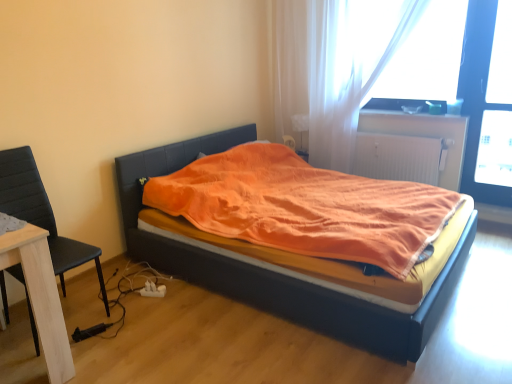
Question: Is transparent glass screen door at upper right facing towards translucent fabric curtain at upper right?

Choices:
 (A) no
 (B) yes

Answer: (A)

Question: Is transparent glass screen door at upper right positioned with its back to translucent fabric curtain at upper right?

Choices:
 (A) no
 (B) yes

Answer: (A)

Question: Are transparent glass screen door at upper right and translucent fabric curtain at upper right located far from each other?

Choices:
 (A) yes
 (B) no

Answer: (A)

Question: From a real-world perspective, is transparent glass screen door at upper right on top of translucent fabric curtain at upper right?

Choices:
 (A) no
 (B) yes

Answer: (A)

Question: Is transparent glass screen door at upper right smaller than translucent fabric curtain at upper right?

Choices:
 (A) no
 (B) yes

Answer: (B)

Question: Is the depth of transparent glass screen door at upper right greater than that of translucent fabric curtain at upper right?

Choices:
 (A) no
 (B) yes

Answer: (B)

Question: Is white textured radiator at upper right at the back of translucent fabric curtain at upper right?

Choices:
 (A) yes
 (B) no

Answer: (A)

Question: Considering the relative sizes of translucent fabric curtain at upper right and white textured radiator at upper right in the image provided, is translucent fabric curtain at upper right shorter than white textured radiator at upper right?

Choices:
 (A) no
 (B) yes

Answer: (A)

Question: From a real-world perspective, is translucent fabric curtain at upper right located higher than white textured radiator at upper right?

Choices:
 (A) no
 (B) yes

Answer: (B)

Question: Does translucent fabric curtain at upper right come in front of white textured radiator at upper right?

Choices:
 (A) yes
 (B) no

Answer: (A)

Question: Is translucent fabric curtain at upper right next to white textured radiator at upper right?

Choices:
 (A) no
 (B) yes

Answer: (A)

Question: Is the depth of translucent fabric curtain at upper right greater than that of white textured radiator at upper right?

Choices:
 (A) yes
 (B) no

Answer: (B)

Question: Is the depth of transparent plastic window screen at upper right greater than that of black leather chair at left?

Choices:
 (A) no
 (B) yes

Answer: (B)